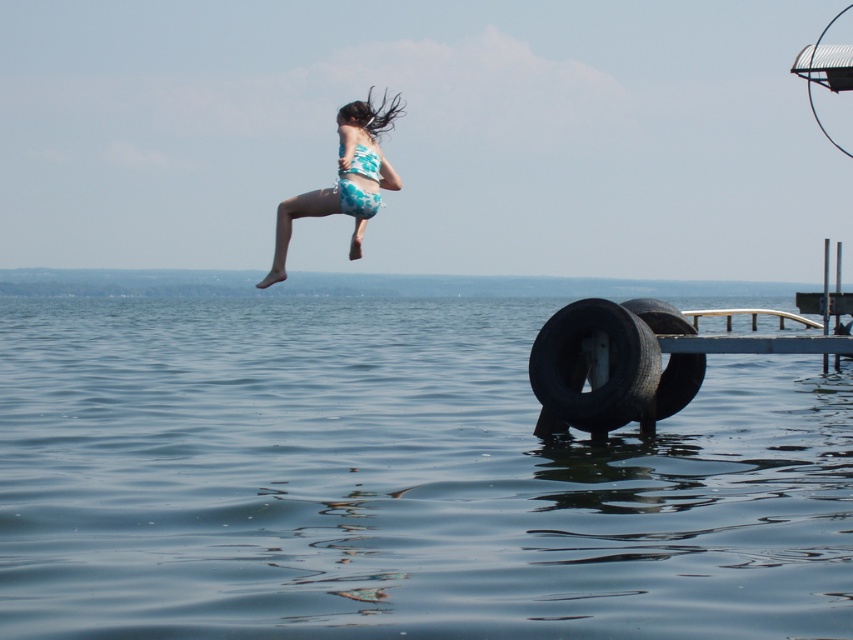
Question: Which point is closer to the camera taking this photo?

Choices:
 (A) pyautogui.click(x=647, y=385)
 (B) pyautogui.click(x=686, y=372)
 (C) pyautogui.click(x=28, y=298)
 (D) pyautogui.click(x=285, y=204)

Answer: (D)

Question: Which point is closer to the camera?

Choices:
 (A) (534, 380)
 (B) (686, 381)

Answer: (A)

Question: Can you confirm if dark gray rubber tire at lower center is positioned to the left of teal printed bikini at upper center?

Choices:
 (A) yes
 (B) no

Answer: (B)

Question: Is teal printed bikini at upper center to the right of black rubber tire at lower right from the viewer's perspective?

Choices:
 (A) no
 (B) yes

Answer: (A)

Question: Which point is closer to the camera?

Choices:
 (A) dark gray rubber tire at lower center
 (B) black rubber tire at lower right
 (C) transparent blue water at lower center

Answer: (C)

Question: Is dark gray rubber tire at lower center closer to the viewer compared to teal printed bikini at upper center?

Choices:
 (A) yes
 (B) no

Answer: (B)